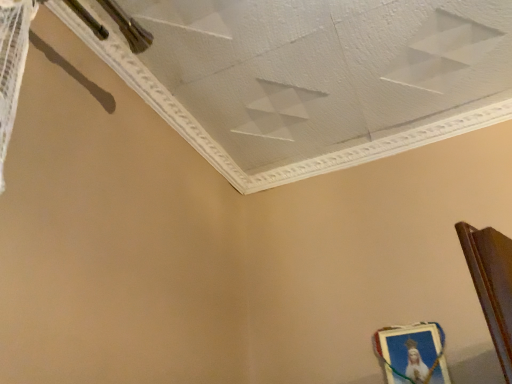
Question: Should I look upward or downward to see white textured ceiling at upper center?

Choices:
 (A) down
 (B) up

Answer: (B)

Question: Is white textured ceiling at upper center oriented towards metallic gold picture frame at lower right?

Choices:
 (A) no
 (B) yes

Answer: (A)

Question: From the image's perspective, is white textured ceiling at upper center on metallic gold picture frame at lower right?

Choices:
 (A) no
 (B) yes

Answer: (B)

Question: Is white textured ceiling at upper center positioned before metallic gold picture frame at lower right?

Choices:
 (A) no
 (B) yes

Answer: (B)

Question: Can you confirm if white textured ceiling at upper center is wider than metallic gold picture frame at lower right?

Choices:
 (A) no
 (B) yes

Answer: (B)

Question: Is white textured ceiling at upper center to the right of metallic gold picture frame at lower right from the viewer's perspective?

Choices:
 (A) no
 (B) yes

Answer: (A)

Question: Does white textured ceiling at upper center have a lesser width compared to metallic gold picture frame at lower right?

Choices:
 (A) no
 (B) yes

Answer: (A)

Question: From a real-world perspective, is metallic gold picture frame at lower right positioned over white textured ceiling at upper center based on gravity?

Choices:
 (A) yes
 (B) no

Answer: (B)

Question: Does metallic gold picture frame at lower right appear on the right side of white textured ceiling at upper center?

Choices:
 (A) no
 (B) yes

Answer: (B)

Question: From the image's perspective, is metallic gold picture frame at lower right located above white textured ceiling at upper center?

Choices:
 (A) yes
 (B) no

Answer: (B)

Question: Is metallic gold picture frame at lower right outside of white textured ceiling at upper center?

Choices:
 (A) yes
 (B) no

Answer: (A)

Question: Is metallic gold picture frame at lower right facing away from white textured ceiling at upper center?

Choices:
 (A) yes
 (B) no

Answer: (B)

Question: Is metallic gold picture frame at lower right closer to the viewer compared to white textured ceiling at upper center?

Choices:
 (A) yes
 (B) no

Answer: (B)

Question: Would you say white textured ceiling at upper center is inside or outside metallic gold picture frame at lower right?

Choices:
 (A) outside
 (B) inside

Answer: (A)